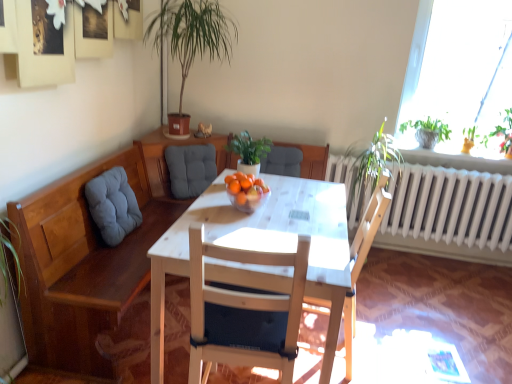
Question: Is green matte plant at center, which ranks as the 1th houseplant in bottom-to-top order, beside green leafy plant at upper right?

Choices:
 (A) yes
 (B) no

Answer: (B)

Question: From a real-world perspective, is green matte plant at center, which ranks as the 1th houseplant in bottom-to-top order, on top of green leafy plant at upper right?

Choices:
 (A) no
 (B) yes

Answer: (A)

Question: From a real-world perspective, is green matte plant at center, which ranks as the 1th houseplant in bottom-to-top order, below green leafy plant at upper right?

Choices:
 (A) yes
 (B) no

Answer: (A)

Question: Does green matte plant at center, which ranks as the 1th houseplant in bottom-to-top order, lie behind green leafy plant at upper right?

Choices:
 (A) yes
 (B) no

Answer: (B)

Question: From the image's perspective, is green matte plant at center, which is the second houseplant in top-to-bottom order, on green leafy plant at upper right?

Choices:
 (A) yes
 (B) no

Answer: (B)

Question: Would you say orange matte at table center is to the left or to the right of gray fabric cushion at center, the 2th chair viewed from the back, in the picture?

Choices:
 (A) right
 (B) left

Answer: (A)

Question: In terms of height, does orange matte at table center look taller or shorter compared to gray fabric cushion at center, the 2th chair viewed from the back?

Choices:
 (A) short
 (B) tall

Answer: (A)

Question: From a real-world perspective, relative to gray fabric cushion at center, the 2th chair viewed from the back, is orange matte at table center vertically above or below?

Choices:
 (A) above
 (B) below

Answer: (A)

Question: Relative to gray fabric cushion at center, the 2th chair viewed from the back, is orange matte at table center in front or behind?

Choices:
 (A) behind
 (B) front

Answer: (B)

Question: Does point (173, 195) appear closer or farther from the camera than point (94, 183)?

Choices:
 (A) closer
 (B) farther

Answer: (B)

Question: From the image's perspective, relative to gray fabric cushion at left, is gray fabric cushion at center, which is counted as the third chair, starting from the front, above or below?

Choices:
 (A) above
 (B) below

Answer: (A)

Question: Is gray fabric cushion at center, which is counted as the third chair, starting from the front, taller or shorter than gray fabric cushion at left?

Choices:
 (A) tall
 (B) short

Answer: (B)

Question: Would you say gray fabric cushion at center, which is counted as the third chair, starting from the front, is to the left or to the right of gray fabric cushion at left in the picture?

Choices:
 (A) left
 (B) right

Answer: (B)

Question: Relative to green matte plant at center, which is the second houseplant in top-to-bottom order, is gray fabric cushion at left in front or behind?

Choices:
 (A) front
 (B) behind

Answer: (A)

Question: From the image's perspective, is gray fabric cushion at left above or below green matte plant at center, which is the second houseplant in top-to-bottom order?

Choices:
 (A) below
 (B) above

Answer: (A)